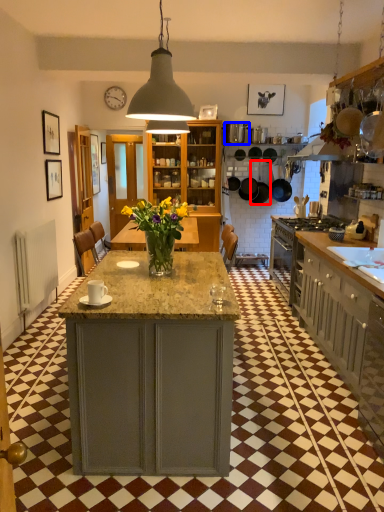
Question: Which of the following is the closest to the observer, frying pan (highlighted by a red box) or kitchen appliance (highlighted by a blue box)?

Choices:
 (A) frying pan
 (B) kitchen appliance

Answer: (B)